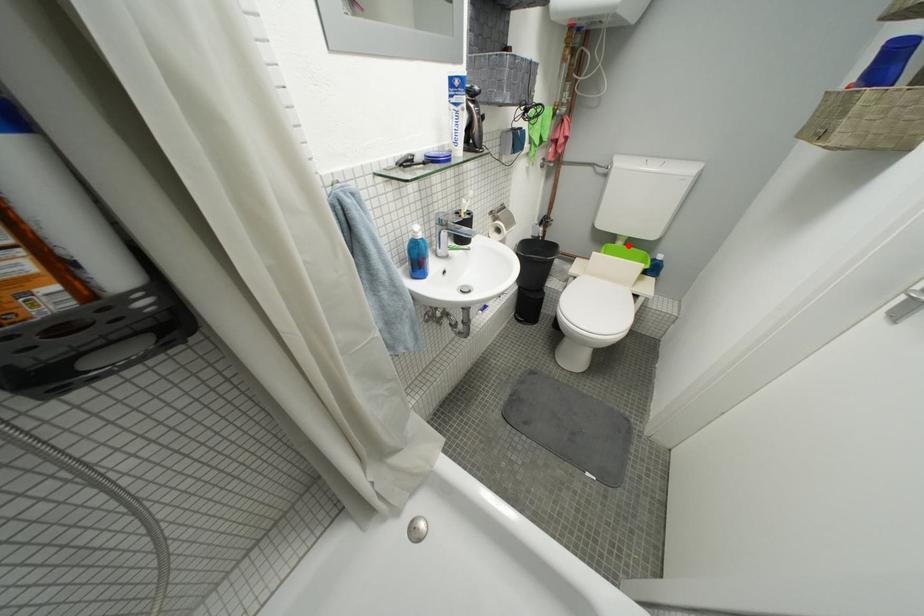
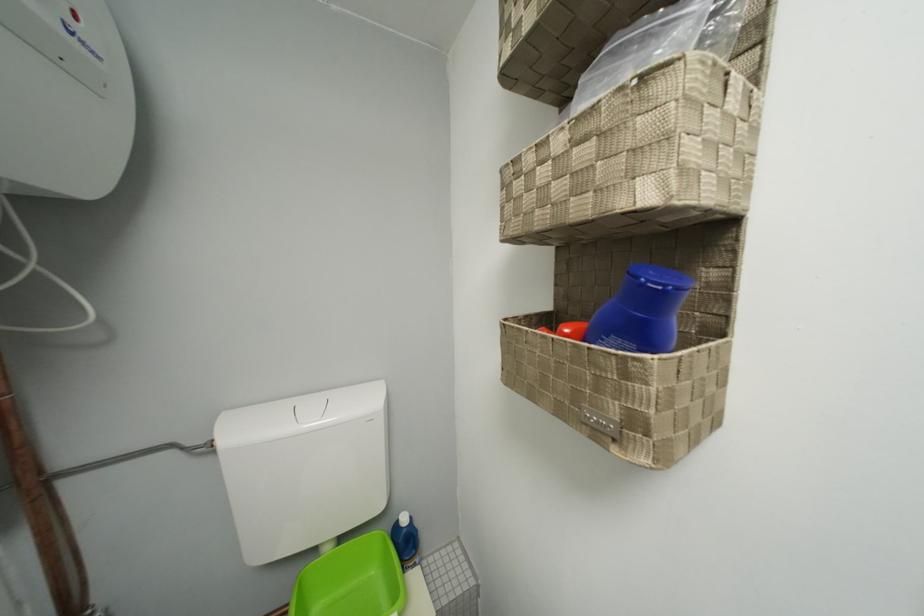
The point at the highlighted location is marked in the first image. Where is the corresponding point in the second image?

(335, 552)